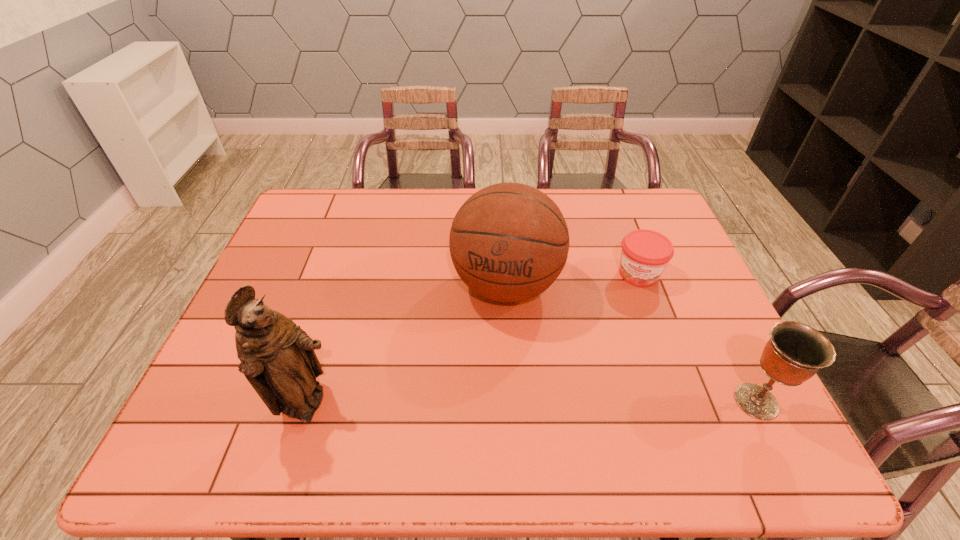
Where is `vacant region at the near edge of the desktop`? This screenshot has height=540, width=960. vacant region at the near edge of the desktop is located at coordinates (593, 403).

The image size is (960, 540). In the image, there is a desktop. In order to click on free space at the left edge in this screenshot , I will do `click(288, 235)`.

Where is `free location at the right edge of the desktop`? The width and height of the screenshot is (960, 540). free location at the right edge of the desktop is located at coordinates (726, 330).

This screenshot has width=960, height=540. I want to click on free spot at the far left corner of the desktop, so pos(330,210).

Find the location of `free space at the far right corner of the desktop`. free space at the far right corner of the desktop is located at coordinates (650, 202).

Identify the location of vacant space in between the figurine and the jam. The width and height of the screenshot is (960, 540). (473, 340).

Find the location of `vacant space in between the leftmost object and the third object from left to right`. vacant space in between the leftmost object and the third object from left to right is located at coordinates (473, 340).

Image resolution: width=960 pixels, height=540 pixels. Find the location of `free spot between the jam and the figurine`. free spot between the jam and the figurine is located at coordinates (473, 340).

Image resolution: width=960 pixels, height=540 pixels. In order to click on unoccupied position between the second object from left to right and the second object from right to left in this screenshot , I will do `click(572, 279)`.

Where is `vacant region between the basketball and the leftmost object`? vacant region between the basketball and the leftmost object is located at coordinates (407, 345).